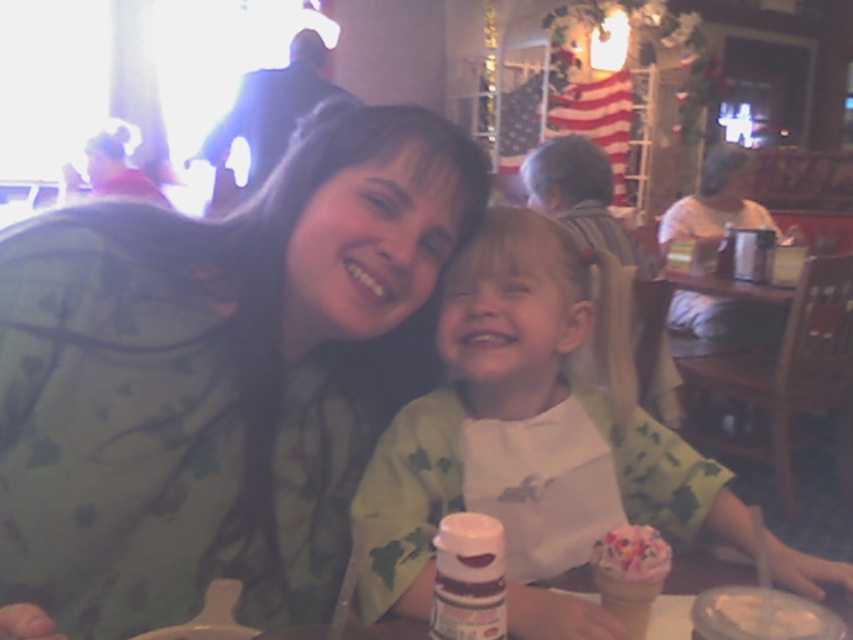
You are trying to decide which dessert to take home. The pink frosted ice cream at center and the smooth white ice cream cone at lower center are both available. Based on their sizes, which one do you think is wider?

The pink frosted ice cream at center is wider than the smooth white ice cream cone at lower center according to the description.

In the scene described, there are two people sitting at a table in a casual dining setting. The adult on the left is wearing a light green top with darker green leaf patterns, and the child on the right has a white shirt with a subtle design. There is an object at point (x=631, y=554). What is the object located at that coordinate?

The object located at point (x=631, y=554) is the pink frosted ice cream at center.